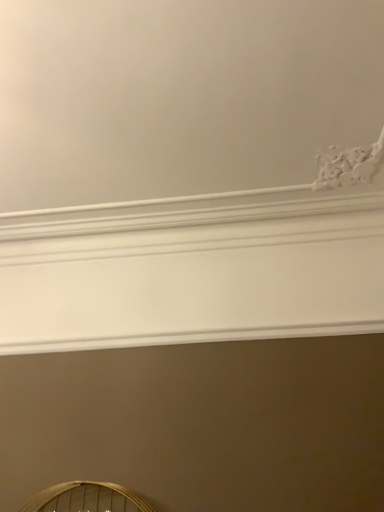
Describe the element at coordinates (180, 96) in the screenshot. The width and height of the screenshot is (384, 512). I see `white matte crown molding at upper right` at that location.

You are a GUI agent. You are given a task and a screenshot of the screen. Output one action in this format:
    pyautogui.click(x=<x>, y=<y>)
    Task: Click on the white matte crown molding at upper right
    
    Given the screenshot: What is the action you would take?
    pyautogui.click(x=180, y=96)

In order to click on white matte crown molding at upper right in this screenshot , I will do `click(180, 96)`.